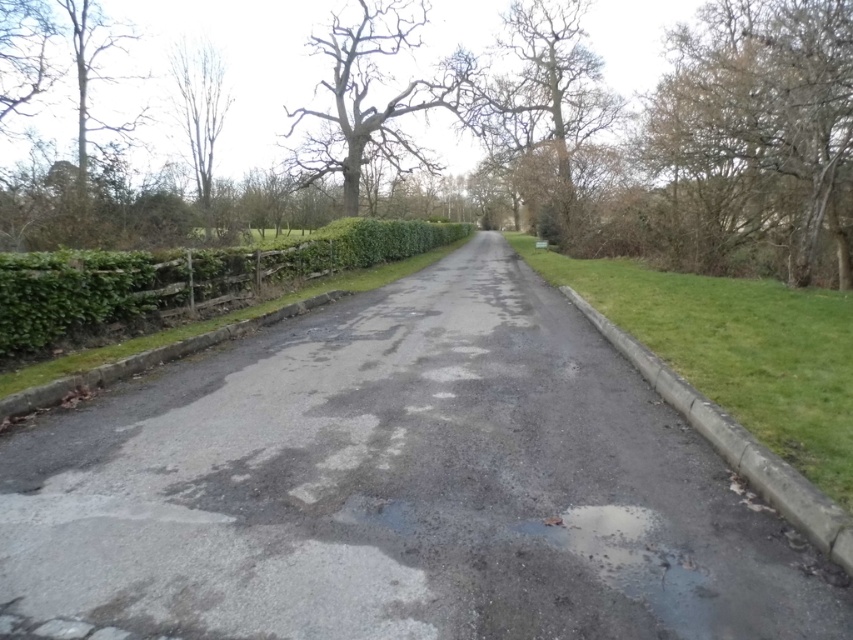
Question: Which object is closer to the camera taking this photo?

Choices:
 (A) bare wood tree at upper left
 (B) bare wood tree at upper right
 (C) green grass at right

Answer: (C)

Question: Can you confirm if bare wood tree at center is wider than bare wood tree at upper left?

Choices:
 (A) yes
 (B) no

Answer: (A)

Question: Which point is farther to the camera?

Choices:
 (A) (421, 250)
 (B) (293, 493)
 (C) (635, 285)
 (D) (187, 128)

Answer: (D)

Question: Which point appears farthest from the camera in this image?

Choices:
 (A) (492, 250)
 (B) (641, 264)

Answer: (A)

Question: Can you confirm if porous asphalt driveway at center is positioned above bare wood tree at upper right?

Choices:
 (A) no
 (B) yes

Answer: (A)

Question: Is bare wood tree at upper right bigger than bare wood tree at center?

Choices:
 (A) no
 (B) yes

Answer: (A)